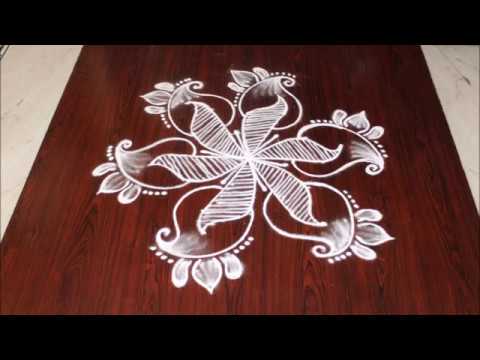
At what (x,y) coordinates should I click in order to perform the action: click on marble on right side. Please return your answer as a coordinate pair (x, y). This screenshot has height=360, width=480. Looking at the image, I should click on (473, 112).